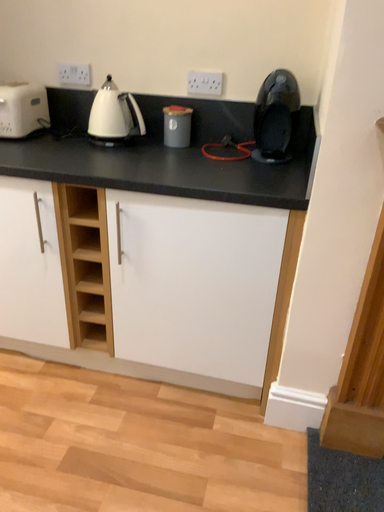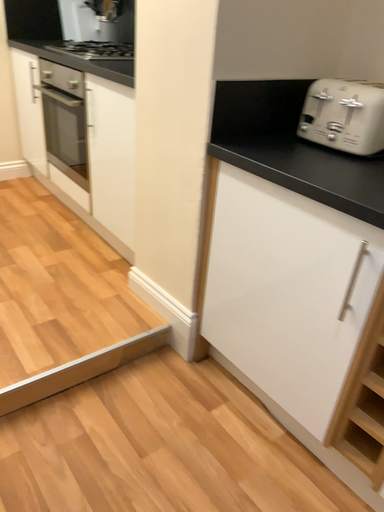
Question: How did the camera likely rotate when shooting the video?

Choices:
 (A) rotated left
 (B) rotated right

Answer: (A)